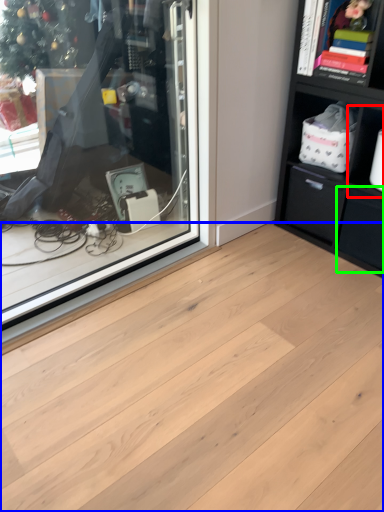
Question: Which is nearer to the cabinet (highlighted by a red box)? plank (highlighted by a blue box) or drawer (highlighted by a green box).

Choices:
 (A) plank
 (B) drawer

Answer: (B)